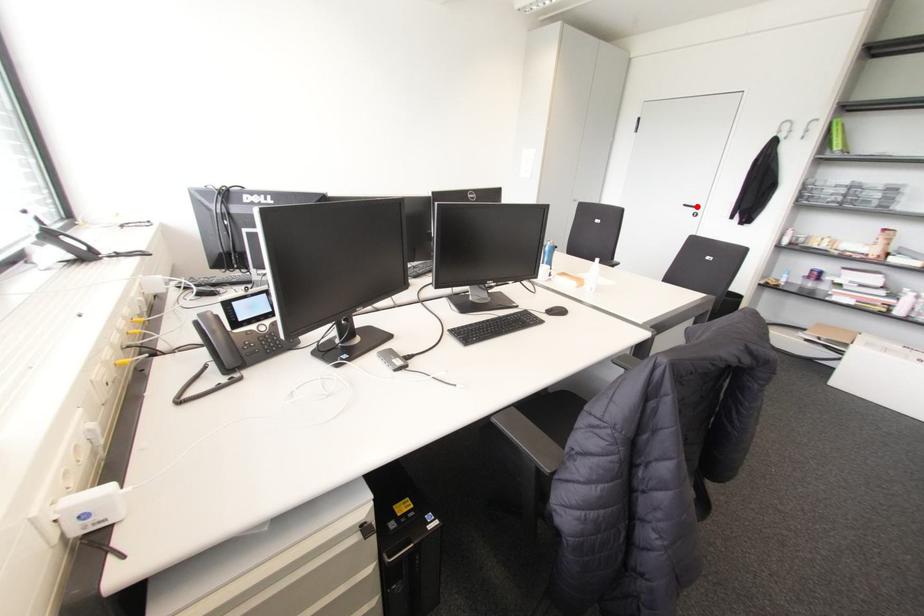
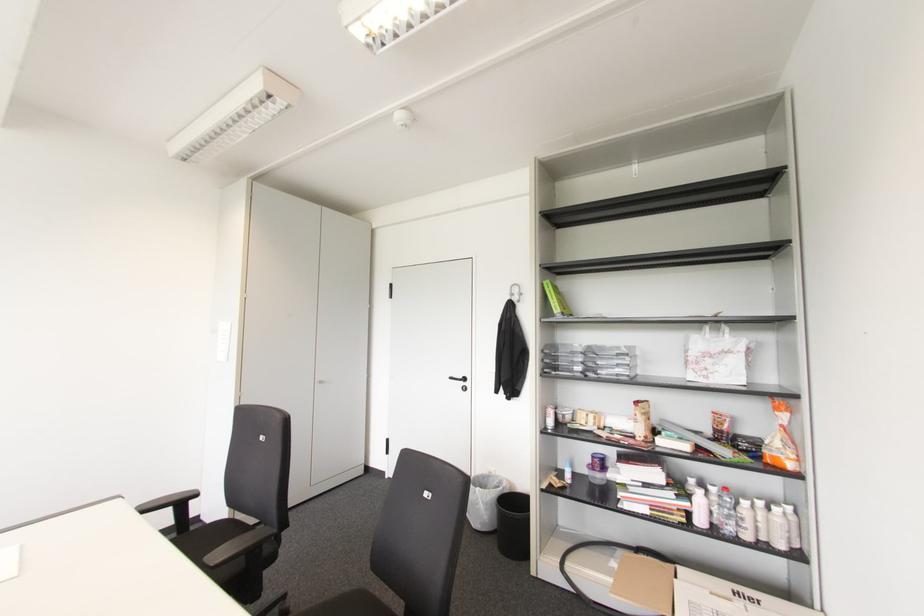
In the second image, find the point that corresponds to the highlighted location in the first image.

(464, 379)